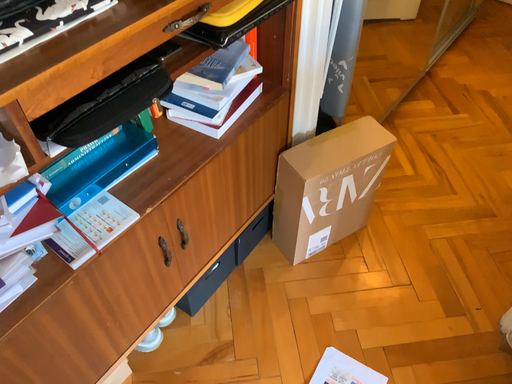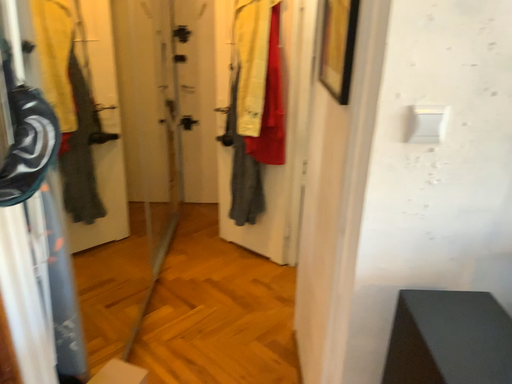
Question: How did the camera likely rotate when shooting the video?

Choices:
 (A) rotated right
 (B) rotated left

Answer: (A)